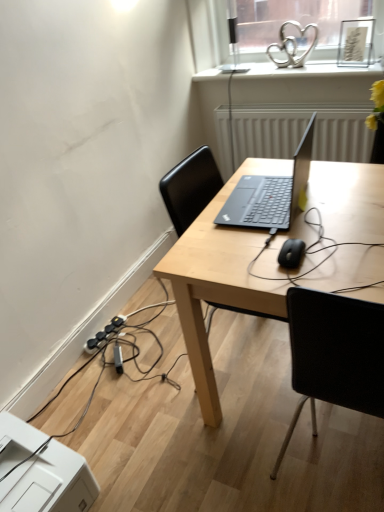
Image resolution: width=384 pixels, height=512 pixels. What are the coordinates of `vacant space that's between black matte mouse at center and sleek silver laptop at center` in the screenshot? It's located at [x=276, y=234].